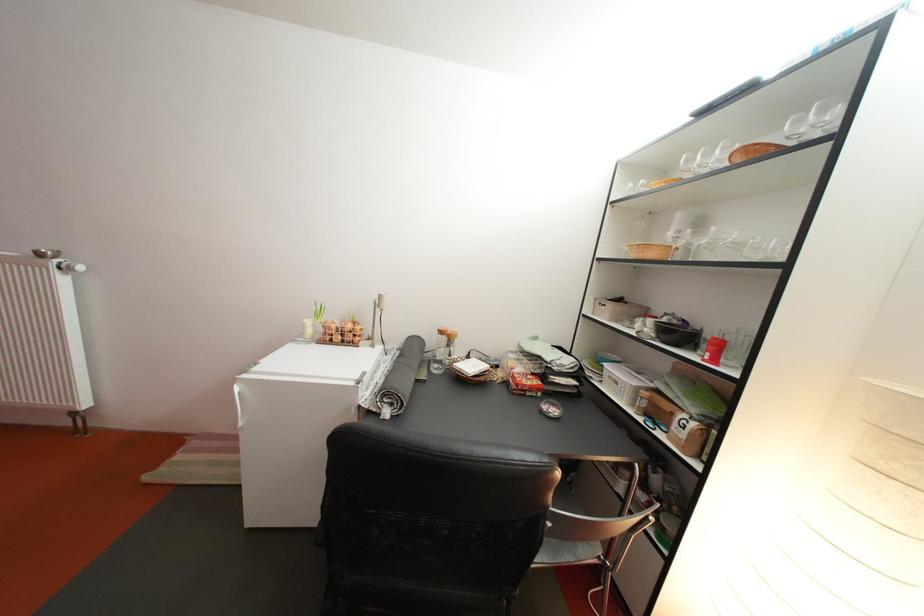
Describe the element at coordinates (444, 336) in the screenshot. I see `the wooden bottle lid` at that location.